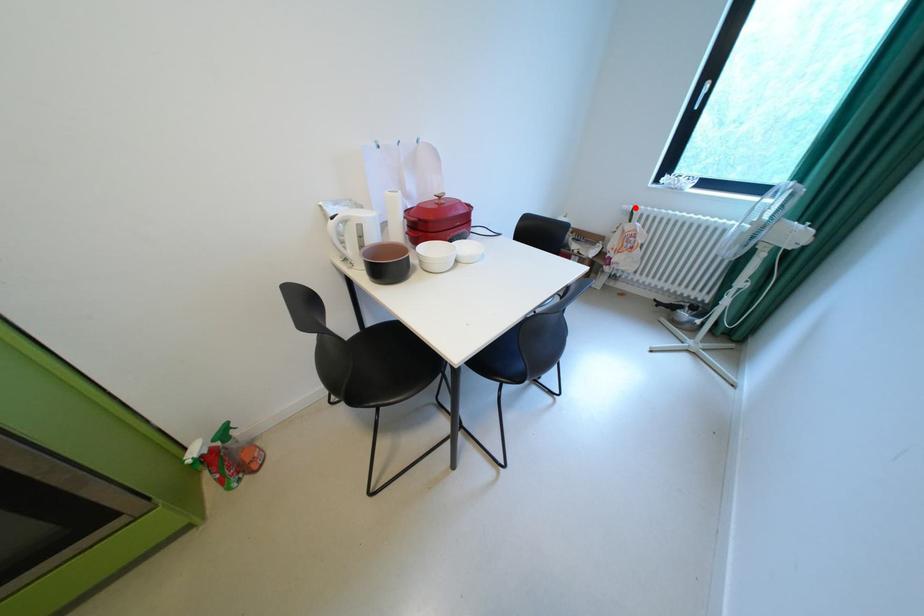
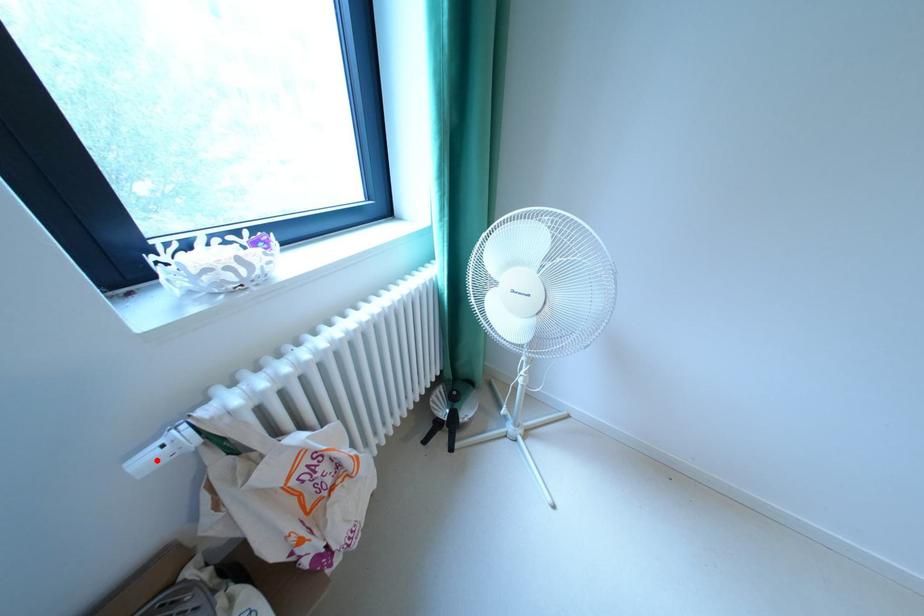
I am providing you with two images of the same scene from different viewpoints. A red point is marked on the first image and another point is marked on the second image. Do the highlighted points in image1 and image2 indicate the same real-world spot?

Yes